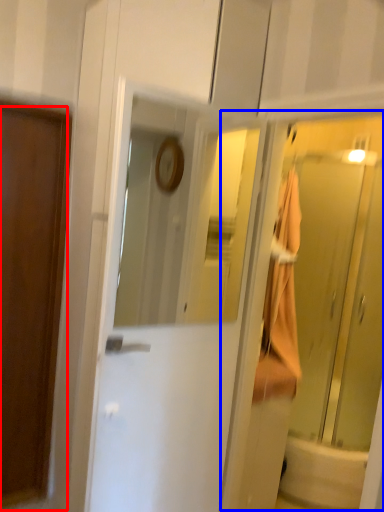
Question: Which of the following is the farthest to the observer, door (highlighted by a red box) or elevator (highlighted by a blue box)?

Choices:
 (A) door
 (B) elevator

Answer: (B)